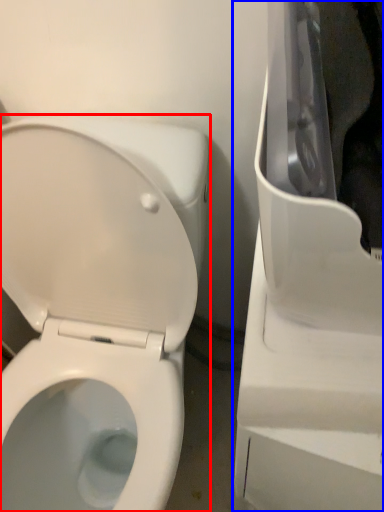
Question: Which of the following is the farthest to the observer, toilet (highlighted by a red box) or appliance (highlighted by a blue box)?

Choices:
 (A) toilet
 (B) appliance

Answer: (A)